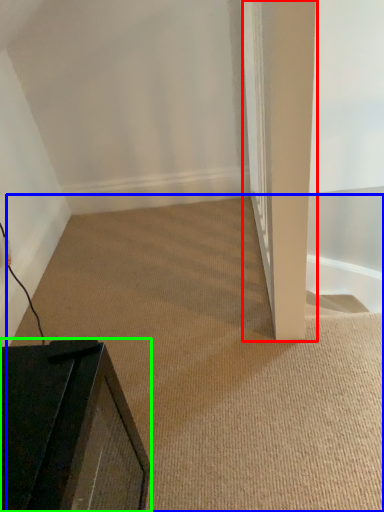
Question: Considering the real-world distances, which object is closest to pillar (highlighted by a red box)? plain (highlighted by a blue box) or furniture (highlighted by a green box).

Choices:
 (A) plain
 (B) furniture

Answer: (A)